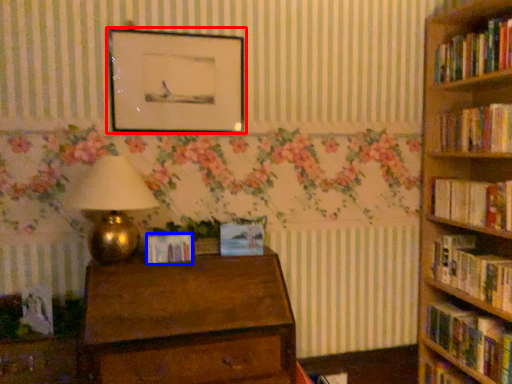
Question: Which of the following is the farthest to the observer, picture frame (highlighted by a red box) or paperback book (highlighted by a blue box)?

Choices:
 (A) picture frame
 (B) paperback book

Answer: (A)